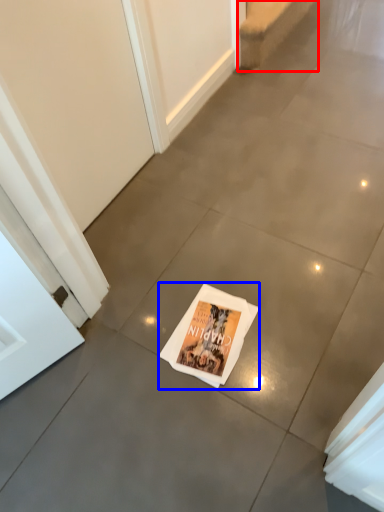
Question: Which point is closer to the camera, stairwell (highlighted by a red box) or magazine (highlighted by a blue box)?

Choices:
 (A) stairwell
 (B) magazine

Answer: (B)